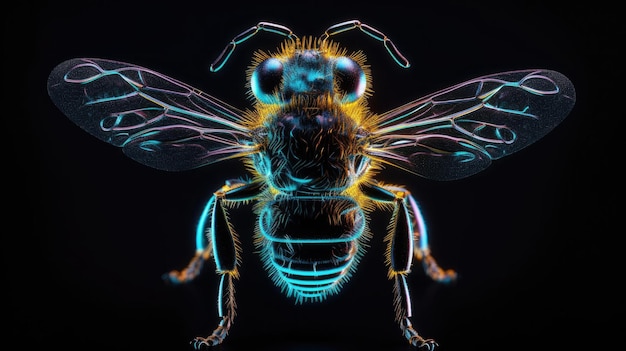
Find the location of a particular element. Image resolution: width=626 pixels, height=351 pixels. right front leg is located at coordinates (223, 301).